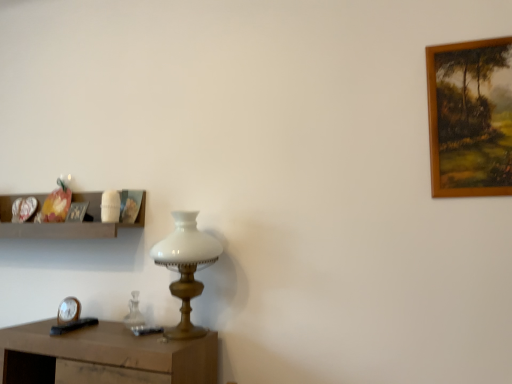
Question: Is wooden shelf at left located outside wooden picture frame at upper left, the second picture frame when ordered from right to left?

Choices:
 (A) no
 (B) yes

Answer: (B)

Question: Can you confirm if wooden shelf at left is shorter than wooden picture frame at upper left, the second picture frame when ordered from right to left?

Choices:
 (A) yes
 (B) no

Answer: (B)

Question: From a real-world perspective, is wooden shelf at left on top of wooden picture frame at upper left, which appears as the 2th picture frame when viewed from the top?

Choices:
 (A) no
 (B) yes

Answer: (A)

Question: Could you tell me if wooden shelf at left is turned towards wooden picture frame at upper left, placed as the 2th picture frame when sorted from front to back?

Choices:
 (A) yes
 (B) no

Answer: (A)

Question: Considering the relative positions of wooden shelf at left and wooden picture frame at upper left, the first picture frame viewed from the back, in the image provided, is wooden shelf at left behind wooden picture frame at upper left, the first picture frame viewed from the back,?

Choices:
 (A) yes
 (B) no

Answer: (B)

Question: Is brown wooden picture frame at upper right, which is counted as the first picture frame, starting from the front, taller or shorter than wooden picture frame at upper left, the first picture frame viewed from the back?

Choices:
 (A) short
 (B) tall

Answer: (B)

Question: Is point (464, 72) positioned closer to the camera than point (77, 215)?

Choices:
 (A) closer
 (B) farther

Answer: (A)

Question: Relative to wooden picture frame at upper left, the first picture frame viewed from the back, is brown wooden picture frame at upper right, which is the 2th picture frame from back to front, in front or behind?

Choices:
 (A) behind
 (B) front

Answer: (B)

Question: Considering the positions of brown wooden picture frame at upper right, the 1th picture frame when ordered from top to bottom, and wooden picture frame at upper left, which ranks as the first picture frame in bottom-to-top order, in the image, is brown wooden picture frame at upper right, the 1th picture frame when ordered from top to bottom, bigger or smaller than wooden picture frame at upper left, which ranks as the first picture frame in bottom-to-top order,?

Choices:
 (A) small
 (B) big

Answer: (B)

Question: Considering the relative positions of wooden picture frame at upper left, the first picture frame viewed from the back, and brown wooden picture frame at upper right, the 1th picture frame when ordered from top to bottom, in the image provided, is wooden picture frame at upper left, the first picture frame viewed from the back, to the left or to the right of brown wooden picture frame at upper right, the 1th picture frame when ordered from top to bottom,?

Choices:
 (A) right
 (B) left

Answer: (B)

Question: Is wooden picture frame at upper left, the second picture frame when ordered from right to left, in front of or behind brown wooden picture frame at upper right, the 2th picture frame from the bottom, in the image?

Choices:
 (A) behind
 (B) front

Answer: (A)

Question: Considering the positions of wooden picture frame at upper left, the second picture frame when ordered from right to left, and brown wooden picture frame at upper right, the 1th picture frame when ordered from top to bottom, in the image, is wooden picture frame at upper left, the second picture frame when ordered from right to left, bigger or smaller than brown wooden picture frame at upper right, the 1th picture frame when ordered from top to bottom,?

Choices:
 (A) big
 (B) small

Answer: (B)

Question: Considering the positions of wooden picture frame at upper left, placed as the 2th picture frame when sorted from front to back, and brown wooden picture frame at upper right, which is counted as the 2th picture frame, starting from the left, in the image, is wooden picture frame at upper left, placed as the 2th picture frame when sorted from front to back, taller or shorter than brown wooden picture frame at upper right, which is counted as the 2th picture frame, starting from the left,?

Choices:
 (A) short
 (B) tall

Answer: (A)

Question: From the image's perspective, is wooden shelf at left above or below white glass table lamp at center?

Choices:
 (A) above
 (B) below

Answer: (A)

Question: Considering their positions, is wooden shelf at left located in front of or behind white glass table lamp at center?

Choices:
 (A) behind
 (B) front

Answer: (A)